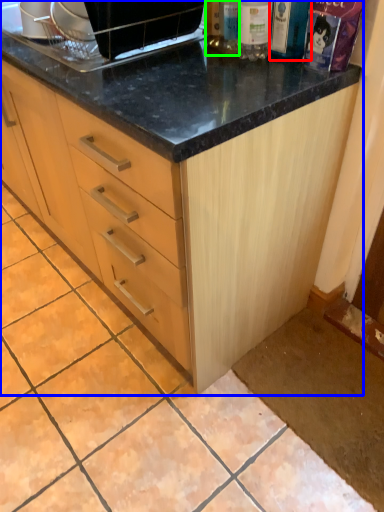
Question: Considering the real-world distances, which object is farthest from bottle (highlighted by a red box)? cabinetry (highlighted by a blue box) or bottle (highlighted by a green box)?

Choices:
 (A) cabinetry
 (B) bottle

Answer: (A)